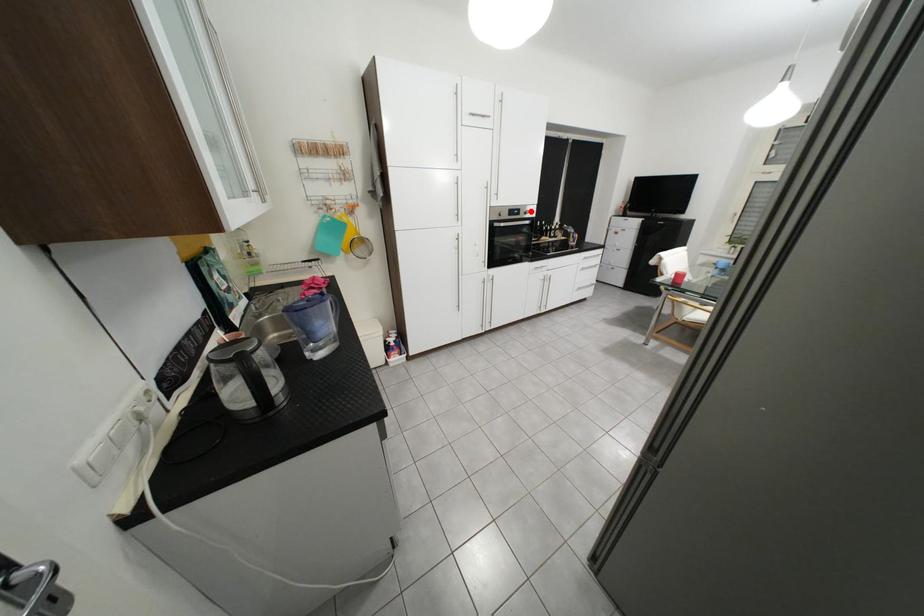
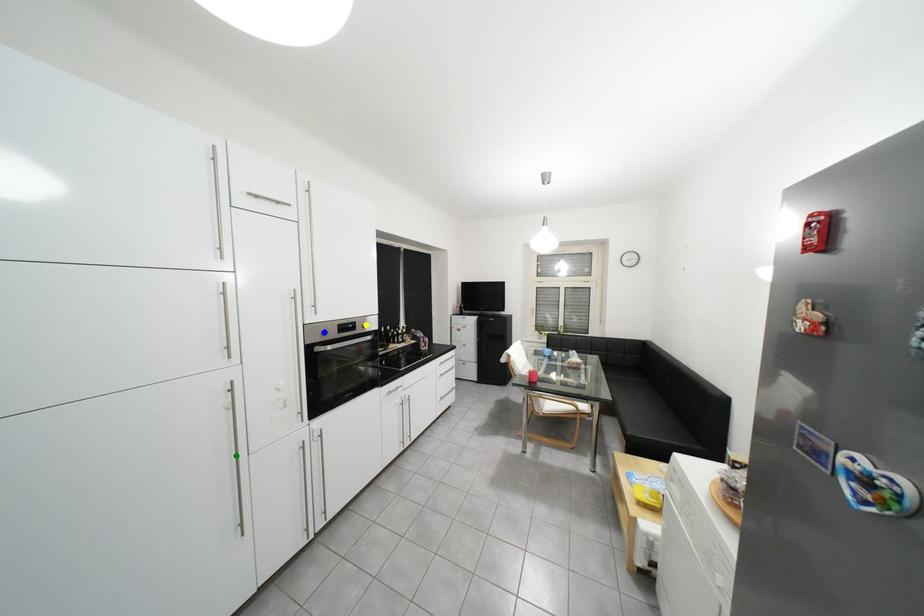
Question: I am providing you with two images of the same scene from different viewpoints. A red point is marked on the first image. You are given multiple points on the second image. Which point in image 2 is actually the same real-world point as the red point in image 1?

Choices:
 (A) blue point
 (B) yellow point
 (C) green point

Answer: (B)